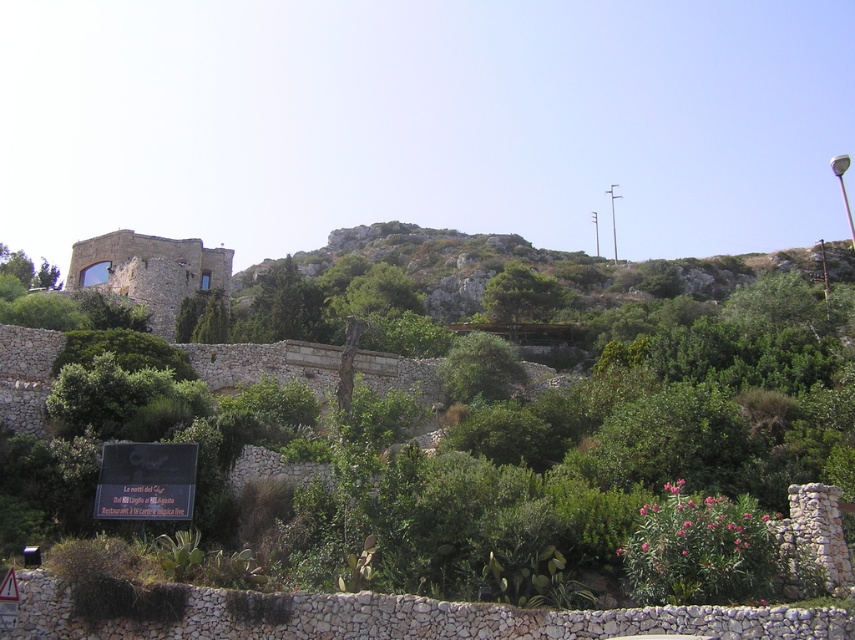
You are standing in the scenic outdoor landscape and want to take a photo of the green leafy tree at center and the green leafy bush at center. Which one should you focus on first if you want to capture both in the frame without moving your camera?

You should focus on the green leafy bush at center first because it is to the left of the green leafy tree at center, so it will be closer to the camera and easier to include in the frame without moving the camera.

You are standing in the scenic outdoor landscape described. You see a point marked at coordinates (149, 272). What does this point indicate?

The point at (149, 272) indicates the location of the rustic stone castle at center left in the scene.